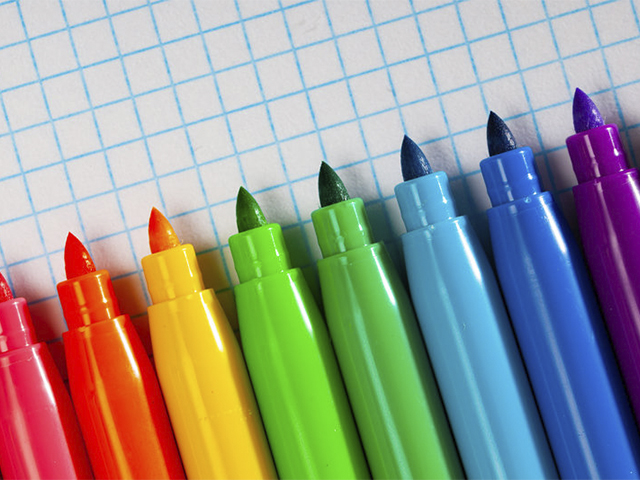
Find the location of a particular element. markers is located at coordinates (621, 215), (530, 247), (448, 276), (347, 288), (278, 321), (194, 331), (95, 379), (35, 396).